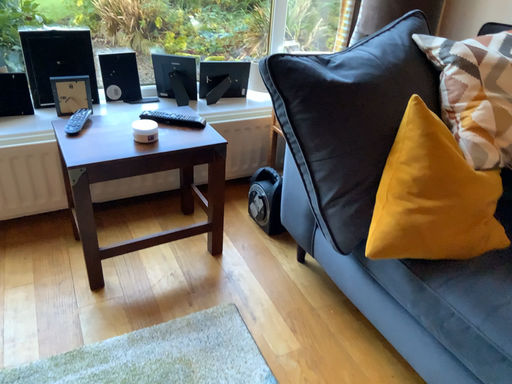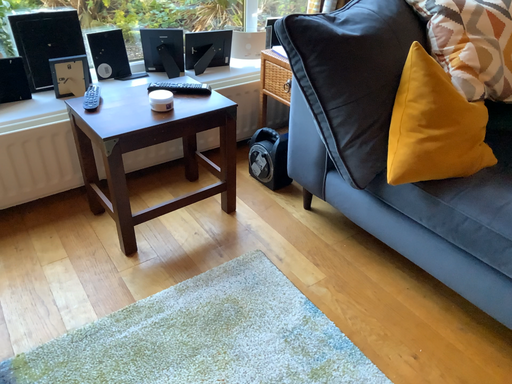
Question: How did the camera likely rotate when shooting the video?

Choices:
 (A) rotated right
 (B) rotated left

Answer: (A)